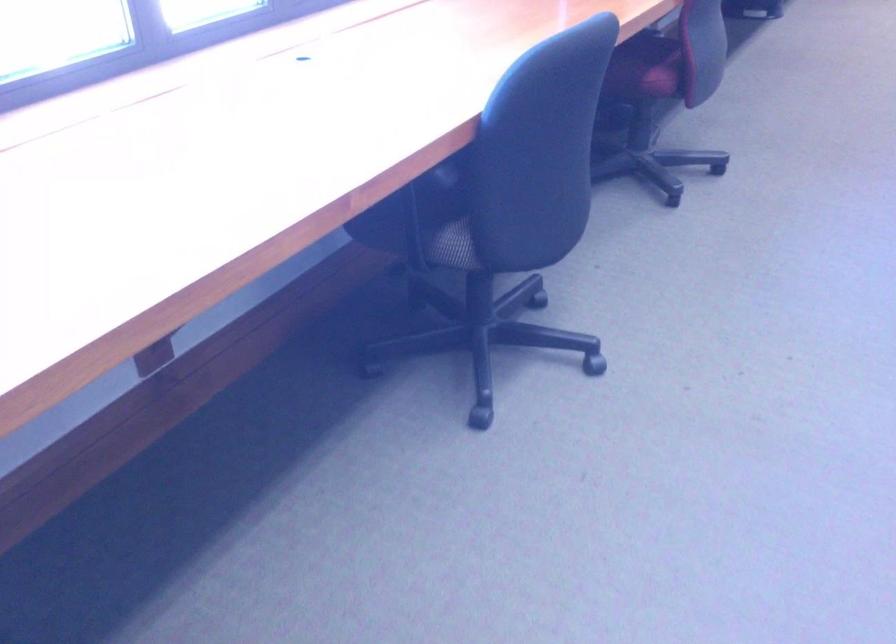
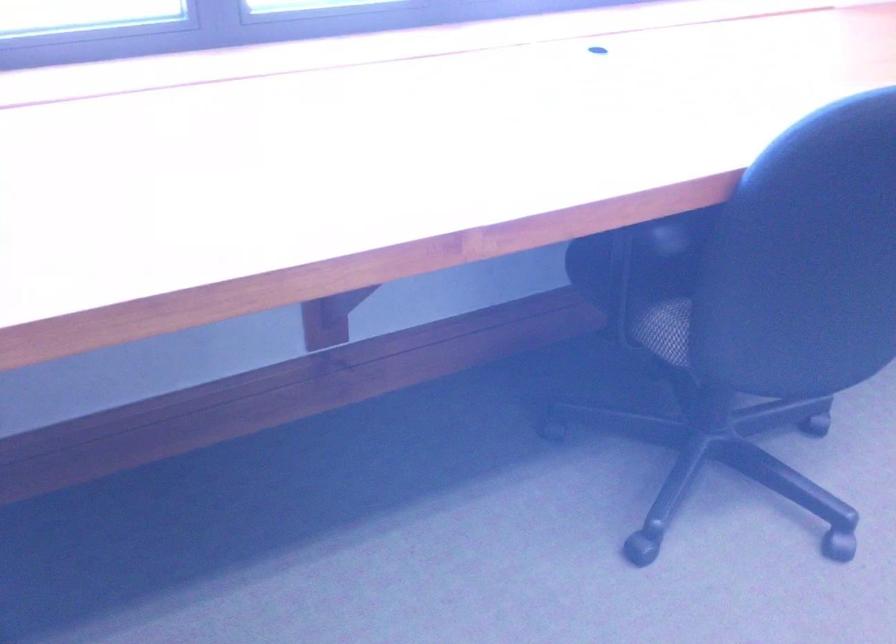
Where in the second image is the point corresponding to point (421, 218) from the first image?

(645, 279)